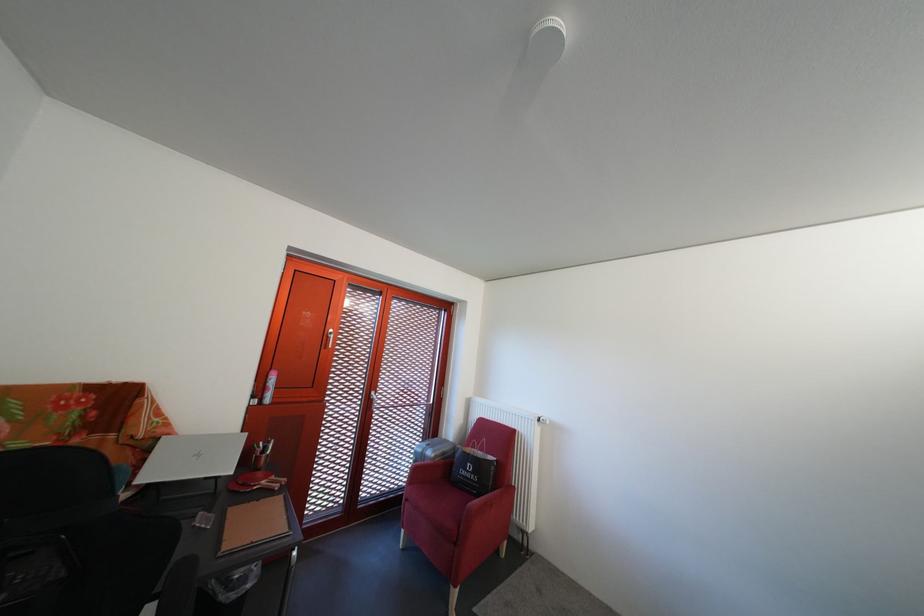
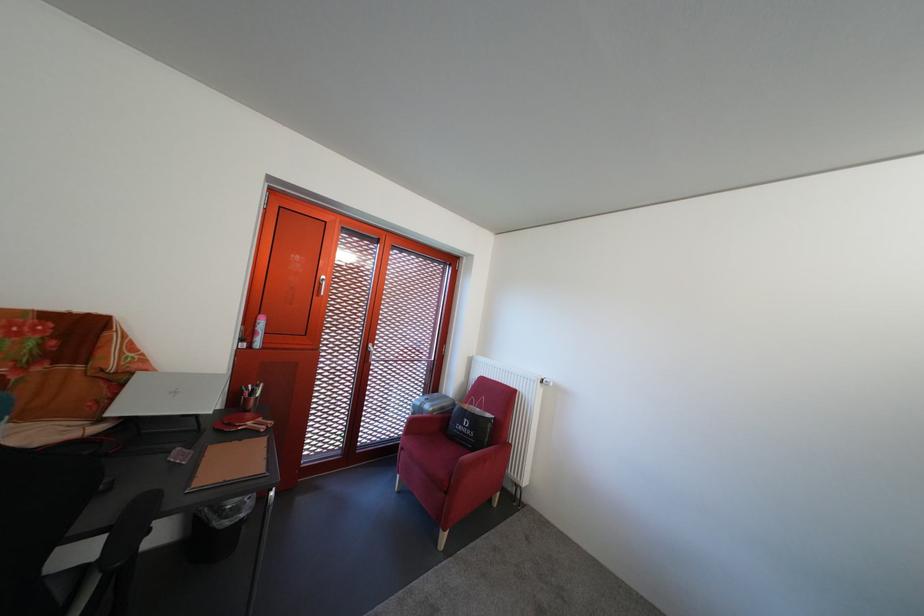
The point at (502, 488) is marked in the first image. Where is the corresponding point in the second image?

(497, 446)